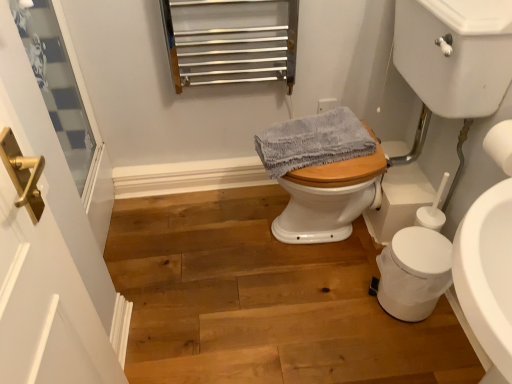
The width and height of the screenshot is (512, 384). I want to click on free region on the left part of white matte trash can at lower right, so click(x=346, y=302).